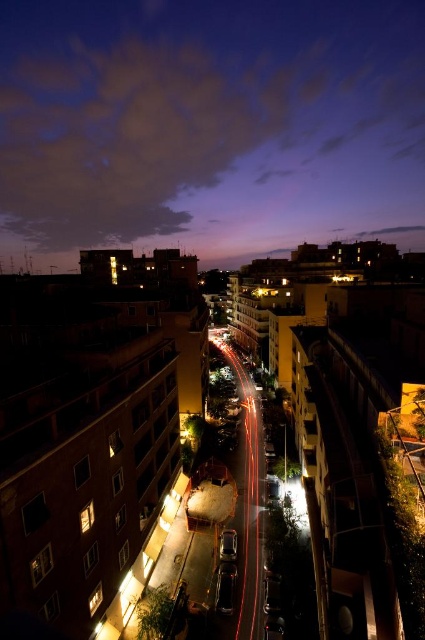
You are a photographer standing in the middle of the street. You want to capture a photo where the purple sky at upper center takes up more space than the shiny silver car at center. Is this possible based on the scene?

Yes, because the purple sky at upper center is wider than the shiny silver car at center, so it will naturally occupy more space in the photo.

You are a photographer standing on a bridge overlooking the city. You notice the purple sky at upper center and the shiny silver car at center. Which object is positioned to the left of the other?

The purple sky at upper center is positioned to the left of the shiny silver car at center.